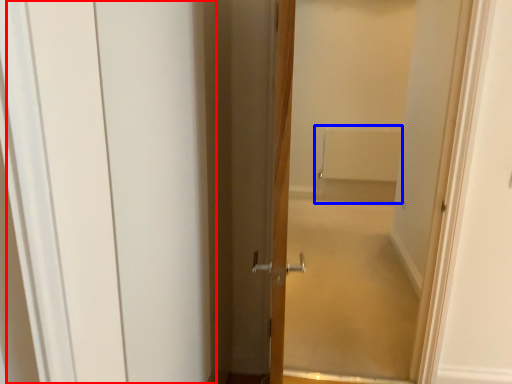
Question: Which point is closer to the camera, barn door (highlighted by a red box) or bath (highlighted by a blue box)?

Choices:
 (A) barn door
 (B) bath

Answer: (A)